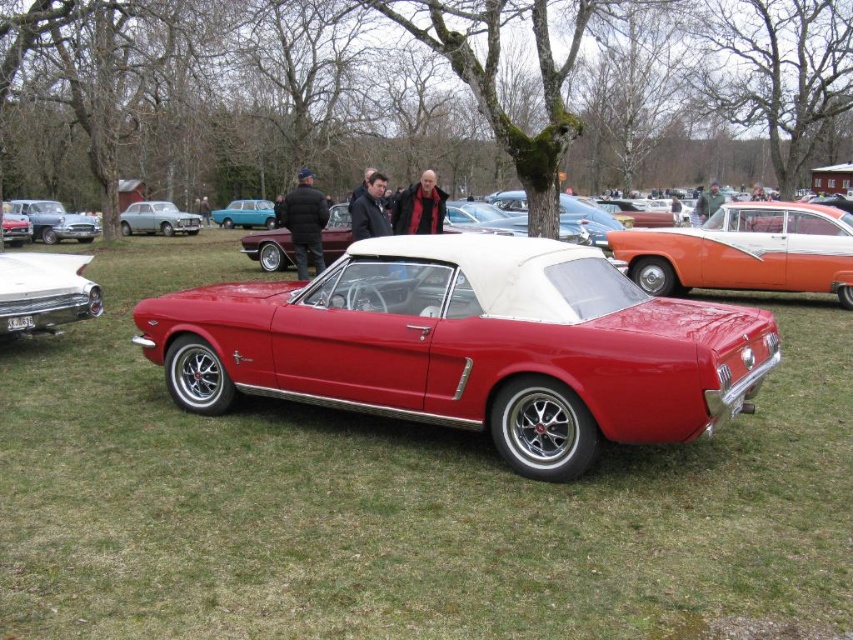
Question: Which of the following is the farthest from the observer?

Choices:
 (A) shiny chrome bumper at lower left
 (B) shiny red convertible at center

Answer: (A)

Question: Which point appears farthest from the camera in this image?

Choices:
 (A) (114, 550)
 (B) (312, 240)
 (C) (727, 396)

Answer: (B)

Question: Is green grass at center smaller than shiny red convertible at center?

Choices:
 (A) no
 (B) yes

Answer: (A)

Question: Does shiny red convertible at center appear on the right side of black leather jacket at center?

Choices:
 (A) yes
 (B) no

Answer: (A)

Question: Which is farther from the shiny chrome bumper at lower left?

Choices:
 (A) green grass at center
 (B) dark red leather jacket at center

Answer: (B)

Question: Does shiny red convertible at center appear on the right side of orange metallic sedan at right?

Choices:
 (A) no
 (B) yes

Answer: (A)